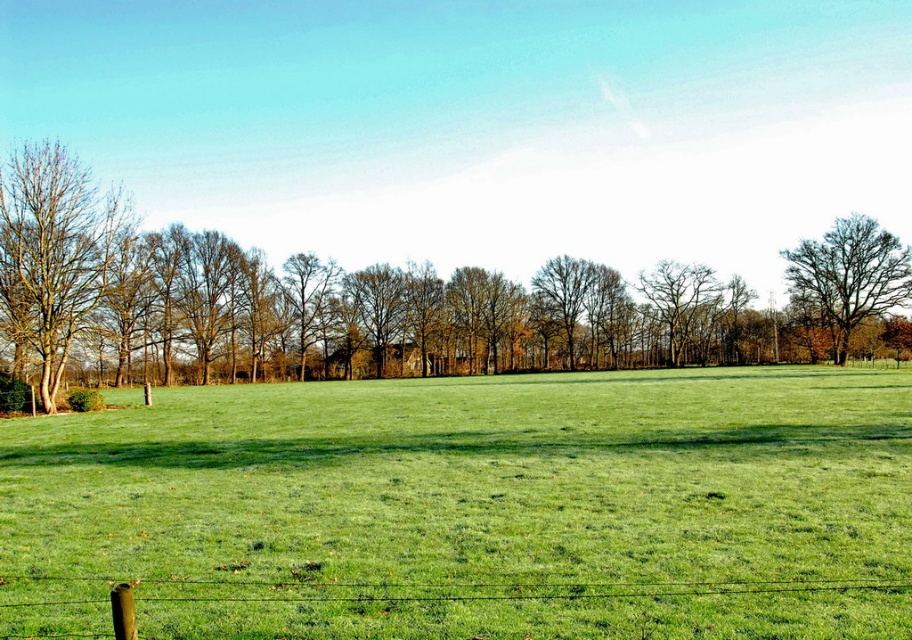
Question: Which object is positioned closest to the brown textured tree at left?

Choices:
 (A) green grassy field at center
 (B) bare brown tree at right
 (C) green wire fence at lower left
 (D) brown leafless tree at left

Answer: (A)

Question: Is green grassy field at center positioned in front of green wire fence at lower left?

Choices:
 (A) yes
 (B) no

Answer: (A)

Question: Estimate the real-world distances between objects in this image. Which object is farther from the green wire fence at lower left?

Choices:
 (A) bare brown tree at right
 (B) brown textured tree at left
 (C) green grassy field at center

Answer: (A)

Question: Is green grassy field at center bigger than brown textured tree at left?

Choices:
 (A) no
 (B) yes

Answer: (A)

Question: Can you confirm if green grassy field at center is wider than bare brown tree at right?

Choices:
 (A) yes
 (B) no

Answer: (A)

Question: Which object is closer to the camera taking this photo?

Choices:
 (A) bare brown tree at right
 (B) brown leafless tree at left
 (C) green wire fence at lower left
 (D) brown textured tree at left

Answer: (C)